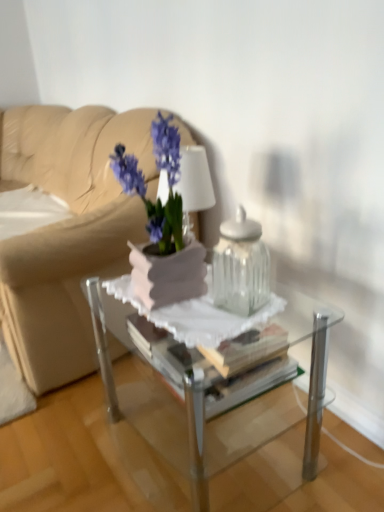
Locate an element on the screen. The height and width of the screenshot is (512, 384). free space to the left of clear glass table at center is located at coordinates (71, 448).